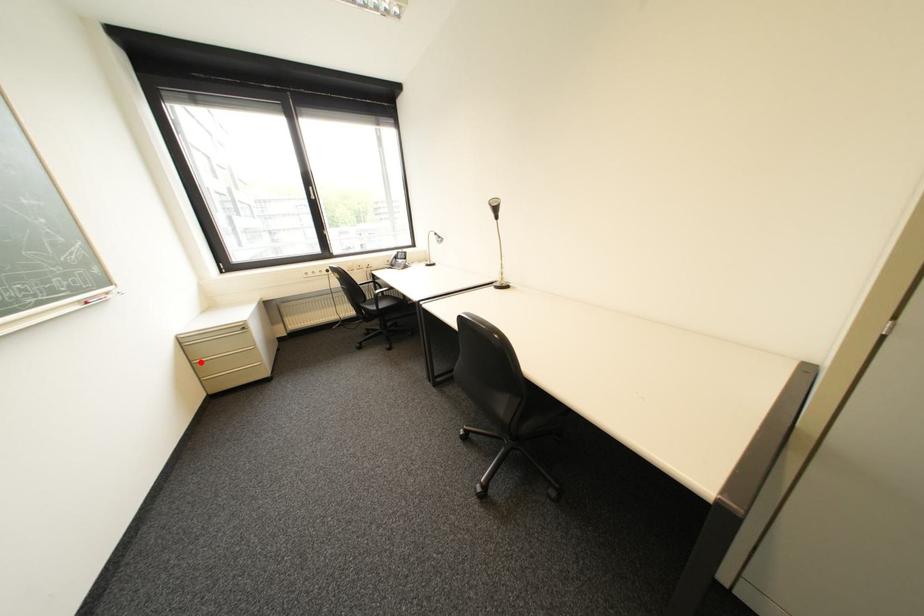
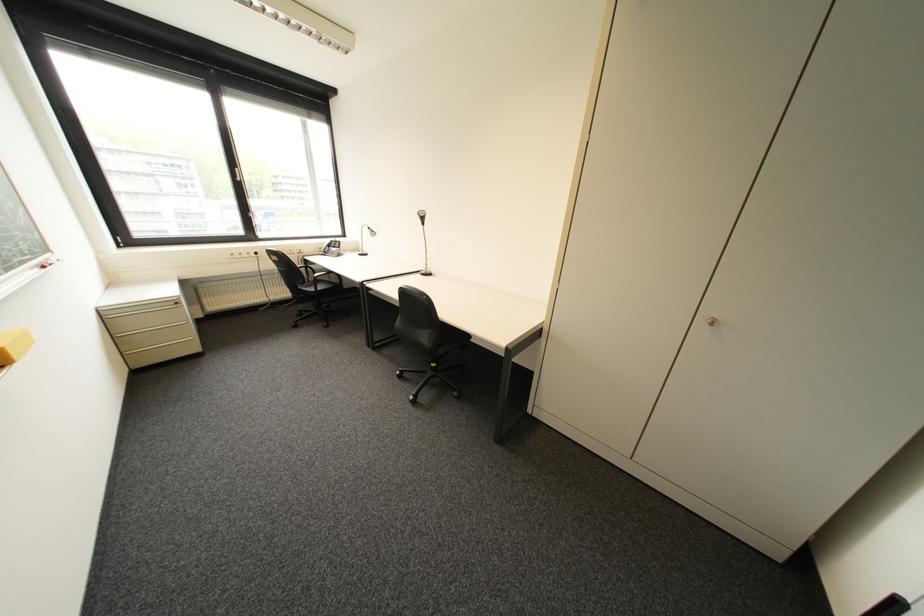
Question: I am providing you with two images of the same scene from different viewpoints. In image1, a red point is highlighted. Considering the same 3D point in image2, which of the following is correct?

Choices:
 (A) It is closer
 (B) It is farther

Answer: (B)